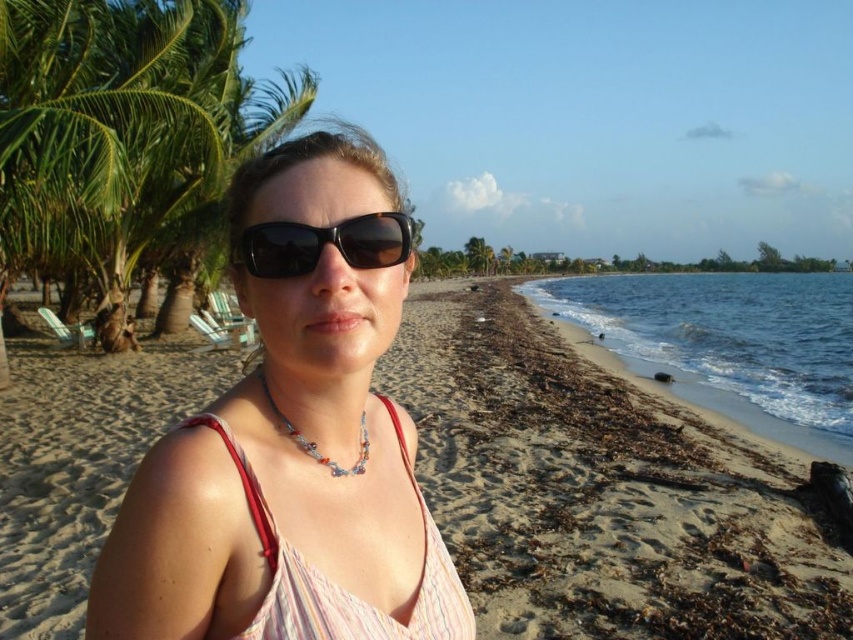
Question: Is pink fabric bikini top at center smaller than black plastic sunglasses at center?

Choices:
 (A) yes
 (B) no

Answer: (B)

Question: Which of the following is the farthest from the observer?

Choices:
 (A) pyautogui.click(x=302, y=273)
 (B) pyautogui.click(x=260, y=381)
 (C) pyautogui.click(x=387, y=516)

Answer: (C)

Question: Among these objects, which one is nearest to the camera?

Choices:
 (A) beige sandy beach at center
 (B) black plastic sunglasses at center
 (C) green leafy palm tree at upper left
 (D) matte black sunglasses at center

Answer: (D)

Question: Is green leafy palm tree at upper left to the right of pink fabric bikini top at center from the viewer's perspective?

Choices:
 (A) yes
 (B) no

Answer: (B)

Question: From the image, what is the correct spatial relationship of beige sandy beach at center in relation to black plastic sunglasses at center?

Choices:
 (A) left
 (B) right

Answer: (A)

Question: Which object appears closest to the camera in this image?

Choices:
 (A) beige sandy beach at center
 (B) matte black sunglasses at center
 (C) black plastic sunglasses at center

Answer: (B)